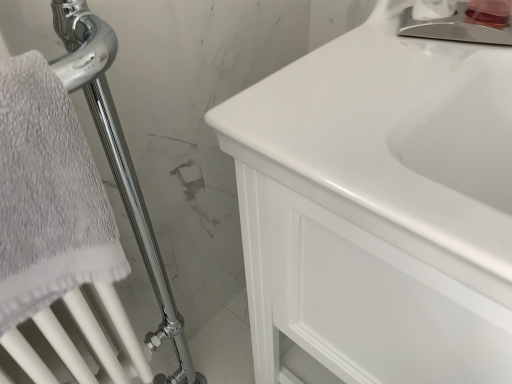
I want to click on white glossy soap dispenser at upper right, which ranks as the second toiletry in right-to-left order, so click(433, 9).

Identify the location of white glossy cabinet at center. (379, 207).

This screenshot has height=384, width=512. What do you see at coordinates (379, 207) in the screenshot?
I see `white glossy cabinet at center` at bounding box center [379, 207].

What do you see at coordinates (489, 12) in the screenshot? The width and height of the screenshot is (512, 384). I see `pink plastic container at upper right, the second toiletry when ordered from left to right` at bounding box center [489, 12].

What do you see at coordinates (454, 29) in the screenshot? I see `polished chrome faucet at upper right` at bounding box center [454, 29].

Identify the location of white glossy soap dispenser at upper right, which ranks as the first toiletry in left-to-right order. (433, 9).

Can you confirm if pink plastic container at upper right, which is counted as the 1th toiletry, starting from the right, is positioned to the right of chrome metallic shower at left?

Yes.

Considering the relative sizes of pink plastic container at upper right, the second toiletry when ordered from left to right, and chrome metallic shower at left in the image provided, is pink plastic container at upper right, the second toiletry when ordered from left to right, wider than chrome metallic shower at left?

→ No, pink plastic container at upper right, the second toiletry when ordered from left to right, is not wider than chrome metallic shower at left.

Between pink plastic container at upper right, which is counted as the 1th toiletry, starting from the right, and chrome metallic shower at left, which one is positioned behind?

pink plastic container at upper right, which is counted as the 1th toiletry, starting from the right.

Between point (488, 14) and point (155, 335), which one is positioned behind?

Positioned behind is point (155, 335).

Based on the photo, who is smaller, polished chrome faucet at upper right or white glossy soap dispenser at upper right, which ranks as the first toiletry in left-to-right order?

white glossy soap dispenser at upper right, which ranks as the first toiletry in left-to-right order, is smaller.

You are a GUI agent. You are given a task and a screenshot of the screen. Output one action in this format:
    pyautogui.click(x=<x>, y=<y>)
    Task: Click on the faucet behind the white glossy soap dispenser at upper right, which ranks as the second toiletry in right-to-left order
    
    Given the screenshot: What is the action you would take?
    click(454, 29)

Could you tell me if polished chrome faucet at upper right is turned towards white glossy soap dispenser at upper right, which ranks as the second toiletry in right-to-left order?

No, polished chrome faucet at upper right is not facing towards white glossy soap dispenser at upper right, which ranks as the second toiletry in right-to-left order.

Is pink plastic container at upper right, which is counted as the 1th toiletry, starting from the right, not near polished chrome faucet at upper right?

No, there isn't a large distance between pink plastic container at upper right, which is counted as the 1th toiletry, starting from the right, and polished chrome faucet at upper right.

Is pink plastic container at upper right, which is counted as the 1th toiletry, starting from the right, taller than polished chrome faucet at upper right?

Yes, pink plastic container at upper right, which is counted as the 1th toiletry, starting from the right, is taller than polished chrome faucet at upper right.

Between pink plastic container at upper right, which is counted as the 1th toiletry, starting from the right, and polished chrome faucet at upper right, which one appears on the left side from the viewer's perspective?

From the viewer's perspective, polished chrome faucet at upper right appears more on the left side.

From the image's perspective, is pink plastic container at upper right, the second toiletry when ordered from left to right, beneath polished chrome faucet at upper right?

No.

Does polished chrome faucet at upper right have a lesser width compared to chrome metallic shower at left?

Yes, polished chrome faucet at upper right is thinner than chrome metallic shower at left.

Would you say polished chrome faucet at upper right contains chrome metallic shower at left?

No, chrome metallic shower at left is located outside of polished chrome faucet at upper right.

Can you tell me how much polished chrome faucet at upper right and chrome metallic shower at left differ in facing direction?

There is a 66.8-degree angle between the facing directions of polished chrome faucet at upper right and chrome metallic shower at left.

Which is more to the right, polished chrome faucet at upper right or chrome metallic shower at left?

Positioned to the right is polished chrome faucet at upper right.

From a real-world perspective, which is physically above, white glossy cabinet at center or white glossy soap dispenser at upper right, which ranks as the second toiletry in right-to-left order?

white glossy soap dispenser at upper right, which ranks as the second toiletry in right-to-left order, is physically above.

Consider the image. Which of these two, white glossy cabinet at center or white glossy soap dispenser at upper right, which ranks as the second toiletry in right-to-left order, stands taller?

With more height is white glossy cabinet at center.

Are white glossy cabinet at center and white glossy soap dispenser at upper right, which ranks as the second toiletry in right-to-left order, located far from each other?

No, white glossy cabinet at center is not far away from white glossy soap dispenser at upper right, which ranks as the second toiletry in right-to-left order.

From the image's perspective, between white glossy cabinet at center and white glossy soap dispenser at upper right, which ranks as the first toiletry in left-to-right order, which one is located above?

white glossy soap dispenser at upper right, which ranks as the first toiletry in left-to-right order.

Is chrome metallic shower at left closer to camera compared to white glossy soap dispenser at upper right, which ranks as the second toiletry in right-to-left order?

Yes, it is.

Who is taller, chrome metallic shower at left or white glossy soap dispenser at upper right, which ranks as the first toiletry in left-to-right order?

chrome metallic shower at left is taller.

Which of these two, chrome metallic shower at left or white glossy soap dispenser at upper right, which ranks as the first toiletry in left-to-right order, is smaller?

With smaller size is white glossy soap dispenser at upper right, which ranks as the first toiletry in left-to-right order.

Does point (57, 27) come behind point (424, 8)?

No, it is not.

From the image's perspective, relative to polished chrome faucet at upper right, is white glossy soap dispenser at upper right, which ranks as the second toiletry in right-to-left order, above or below?

Clearly, from the image's perspective, white glossy soap dispenser at upper right, which ranks as the second toiletry in right-to-left order, is above polished chrome faucet at upper right.

Choose the correct answer: Is white glossy soap dispenser at upper right, which ranks as the second toiletry in right-to-left order, inside polished chrome faucet at upper right or outside it?

white glossy soap dispenser at upper right, which ranks as the second toiletry in right-to-left order, cannot be found inside polished chrome faucet at upper right.

Where is `faucet below the white glossy soap dispenser at upper right, which ranks as the second toiletry in right-to-left order (from a real-world perspective)`? faucet below the white glossy soap dispenser at upper right, which ranks as the second toiletry in right-to-left order (from a real-world perspective) is located at coordinates (454, 29).

Starting from the chrome metallic shower at left, which toiletry is the 1st one behind? Please provide its 2D coordinates.

[(489, 12)]

This screenshot has width=512, height=384. There is a polished chrome faucet at upper right. What are the coordinates of `the 2nd toiletry above it (from the image's perspective)` in the screenshot? It's located at (433, 9).

Looking at the image, which one is located closer to white glossy cabinet at center, pink plastic container at upper right, the second toiletry when ordered from left to right, or white glossy soap dispenser at upper right, which ranks as the second toiletry in right-to-left order?

white glossy soap dispenser at upper right, which ranks as the second toiletry in right-to-left order, lies closer to white glossy cabinet at center than the other object.

Estimate the real-world distances between objects in this image. Which object is further from white glossy soap dispenser at upper right, which ranks as the first toiletry in left-to-right order, pink plastic container at upper right, the second toiletry when ordered from left to right, or polished chrome faucet at upper right?

polished chrome faucet at upper right is positioned further to the anchor white glossy soap dispenser at upper right, which ranks as the first toiletry in left-to-right order.

Looking at the image, which one is located further to polished chrome faucet at upper right, pink plastic container at upper right, which is counted as the 1th toiletry, starting from the right, or white glossy soap dispenser at upper right, which ranks as the second toiletry in right-to-left order?

white glossy soap dispenser at upper right, which ranks as the second toiletry in right-to-left order, is positioned further to the anchor polished chrome faucet at upper right.

Based on their spatial positions, is polished chrome faucet at upper right or chrome metallic shower at left closer to pink plastic container at upper right, the second toiletry when ordered from left to right?

polished chrome faucet at upper right is closer to pink plastic container at upper right, the second toiletry when ordered from left to right.

Looking at the image, which one is located closer to white glossy soap dispenser at upper right, which ranks as the second toiletry in right-to-left order, chrome metallic shower at left or white glossy cabinet at center?

Result: Among the two, white glossy cabinet at center is located nearer to white glossy soap dispenser at upper right, which ranks as the second toiletry in right-to-left order.

From the image, which object appears to be nearer to polished chrome faucet at upper right, white glossy cabinet at center or white glossy soap dispenser at upper right, which ranks as the second toiletry in right-to-left order?

Based on the image, white glossy soap dispenser at upper right, which ranks as the second toiletry in right-to-left order, appears to be nearer to polished chrome faucet at upper right.

When comparing their distances from white glossy cabinet at center, does polished chrome faucet at upper right or white glossy soap dispenser at upper right, which ranks as the second toiletry in right-to-left order, seem closer?

Among the two, polished chrome faucet at upper right is located nearer to white glossy cabinet at center.

Estimate the real-world distances between objects in this image. Which object is further from white glossy cabinet at center, chrome metallic shower at left or pink plastic container at upper right, the second toiletry when ordered from left to right?

pink plastic container at upper right, the second toiletry when ordered from left to right, is further to white glossy cabinet at center.

The height and width of the screenshot is (384, 512). I want to click on toiletry between chrome metallic shower at left and polished chrome faucet at upper right in the horizontal direction, so click(433, 9).

Find the location of `bathroom cabinet between chrome metallic shower at left and pink plastic container at upper right, which is counted as the 1th toiletry, starting from the right, in the horizontal direction`. bathroom cabinet between chrome metallic shower at left and pink plastic container at upper right, which is counted as the 1th toiletry, starting from the right, in the horizontal direction is located at coordinates (379, 207).

Identify the location of toiletry that lies between white glossy soap dispenser at upper right, which ranks as the second toiletry in right-to-left order, and white glossy cabinet at center from top to bottom. The image size is (512, 384). (489, 12).

Locate an element on the screen. The height and width of the screenshot is (384, 512). faucet between chrome metallic shower at left and pink plastic container at upper right, the second toiletry when ordered from left to right, in the horizontal direction is located at coordinates (454, 29).